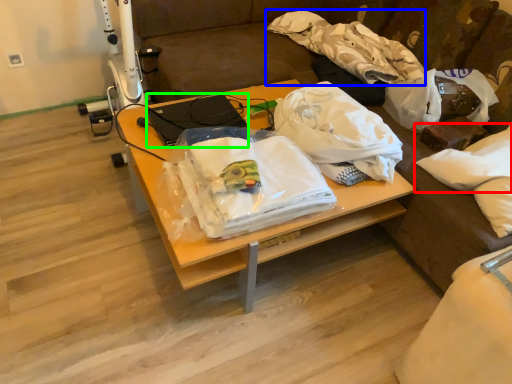
Question: Which object is the farthest from pillow (highlighted by a red box)? Choose among these: cloth (highlighted by a blue box) or laptop (highlighted by a green box).

Choices:
 (A) cloth
 (B) laptop

Answer: (B)